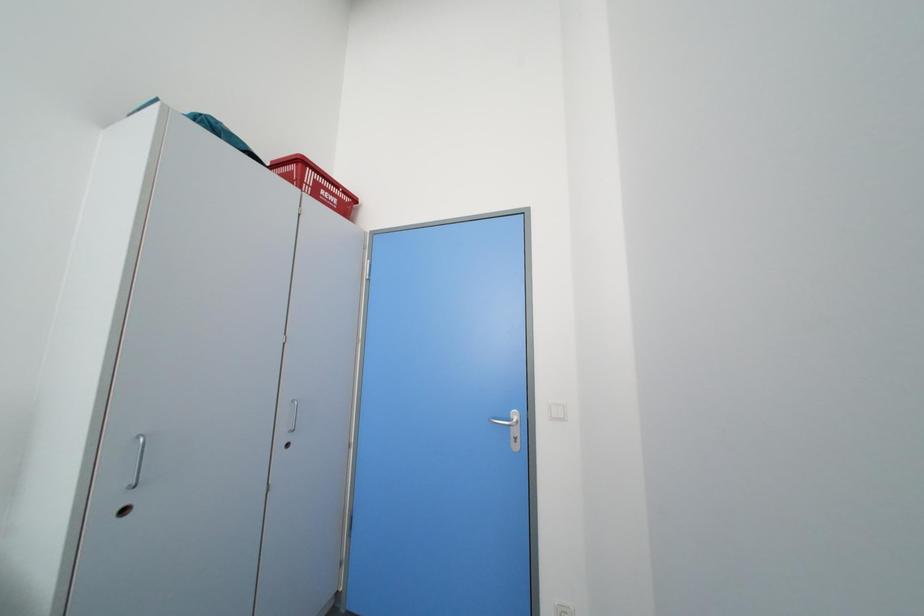
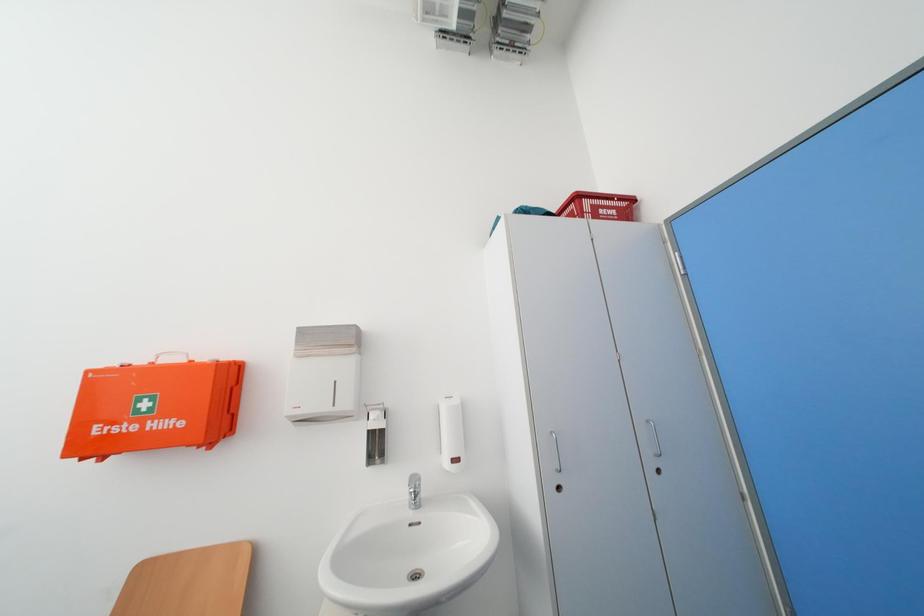
Question: The camera is either moving clockwise (left) or counter-clockwise (right) around the object. The first image is from the beginning of the video and the second image is from the end. Is the camera moving left or right when shooting the video?

Choices:
 (A) Left
 (B) Right

Answer: (B)